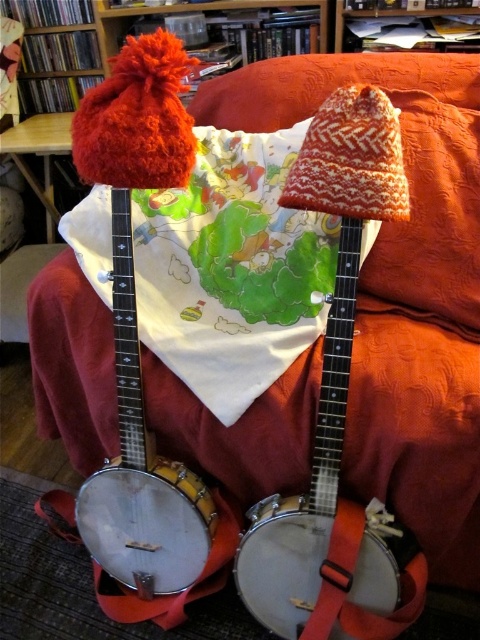
Based on the scene description, where is the matte white banjo at center located in terms of its 2D coordinates?

The matte white banjo at center is located at the 2D coordinates of point (334, 406).

You are arranging two banjos on a couch for a photo shoot. The scene requires the banjo on the left to be the one with the red hat. Given the current setup with the matte white banjo at center and the white wooden banjo at center, which banjo should you move to the left side?

You should move the white wooden banjo at center to the left side because the matte white banjo at center is currently on its right. This will place the white wooden banjo on the left, aligning with the requirement for the left banjo to have the red hat.